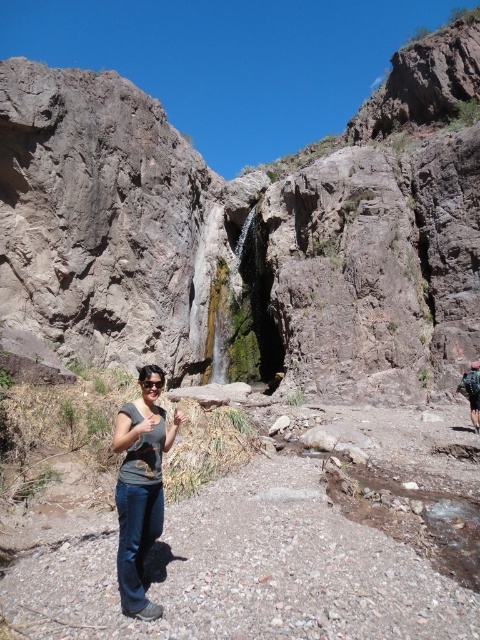
You are a photographer planning to take a picture of the gray matte shirt at center and the dark blue backpack at right. Based on their positions, which object should appear higher in the photo?

The gray matte shirt at center appears higher in the photo because it is positioned above the dark blue backpack at right.

You are a photographer trying to capture a clear shot of the gray matte shirt at center and the dark blue backpack at right. Since the woman is blocking the view of the backpack, can you adjust your position to see both objects without any obstruction?

The gray matte shirt at center is in front of the dark blue backpack at right, so moving your position to the left or right might allow you to see both objects without obstruction.

You are a photographer trying to capture the scenic canyon and waterfall. You have two points marked on your camera screen at coordinates point (136, 449) and point (467, 381). Which point is closer to the camera lens?

Point (136, 449) is in front of point (467, 381), so it is closer to the camera lens.